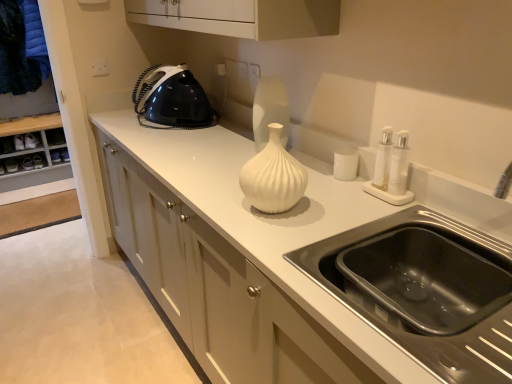
You are a GUI agent. You are given a task and a screenshot of the screen. Output one action in this format:
    pyautogui.click(x=<x>, y=<y>)
    Task: Click on the blank area to the left of white matte cup at center
    This screenshot has width=512, height=384.
    Given the screenshot: What is the action you would take?
    pyautogui.click(x=317, y=180)